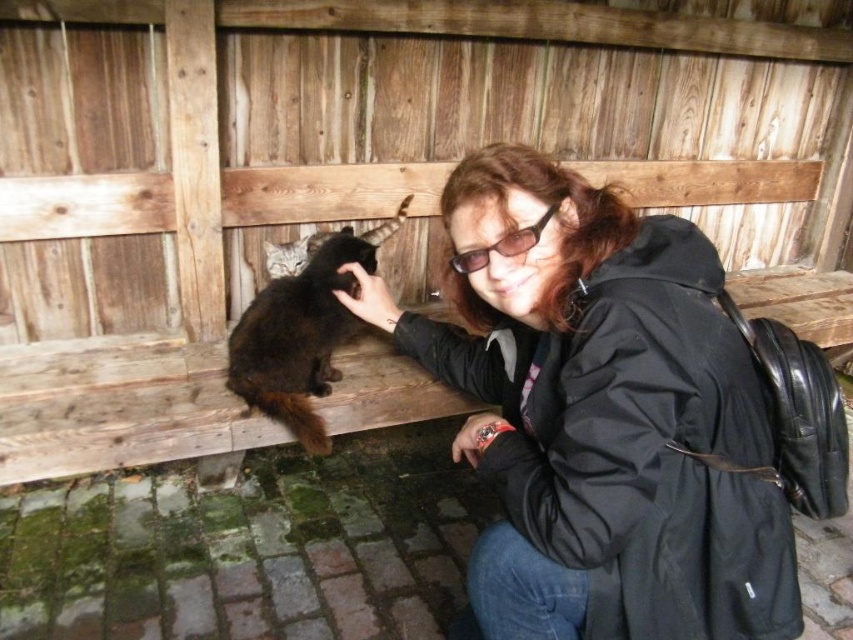
You are a photographer trying to capture a closeup shot of the dark brown fur cat at upper left. The black matte jacket at center is blocking your view. Can you estimate if the jacket can be moved aside without needing to lift it over the cat?

The black matte jacket at center is bigger than the dark brown fur cat at upper left. Since the jacket is larger, it might be possible to move it aside without lifting over the cat, but this depends on the space available around them.

From the picture: You are a photographer trying to capture a clear shot of the black matte jacket at center and the dark brown fur cat at upper left. Since you want the cat to be the main focus, which object should be placed in the foreground to ensure the cat stands out more?

The black matte jacket at center should be placed in the foreground because it is positioned under the dark brown fur cat at upper left, making it closer to the camera and thus ideal for creating depth and drawing attention to the cat in the background.

You are a photographer trying to capture a closeup shot of the dark brown fur cat at upper left. You notice the black matte jacket at center is blocking your view. Can you estimate if moving the jacket to the side would allow you to focus on the cat without obstruction?

The black matte jacket at center is wider than the dark brown fur cat at upper left. Moving the jacket to the side would eliminate the obstruction, allowing you to focus on the cat without any blockage.